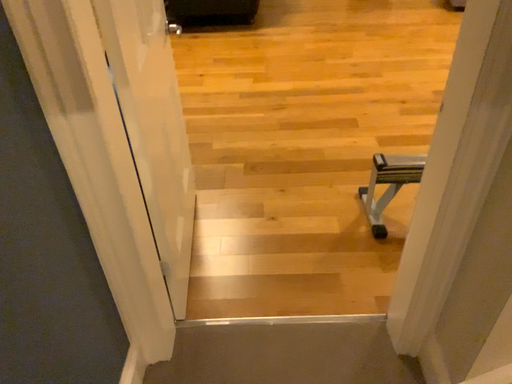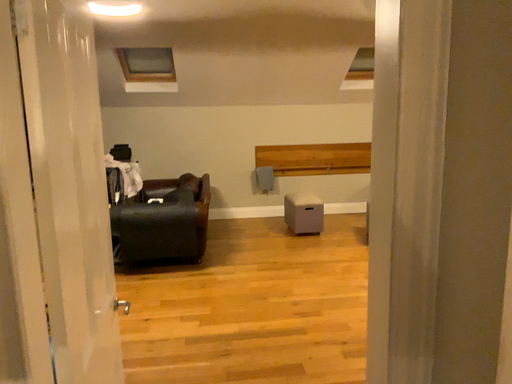
Question: Which way did the camera rotate in the video?

Choices:
 (A) rotated downward
 (B) rotated upward

Answer: (B)